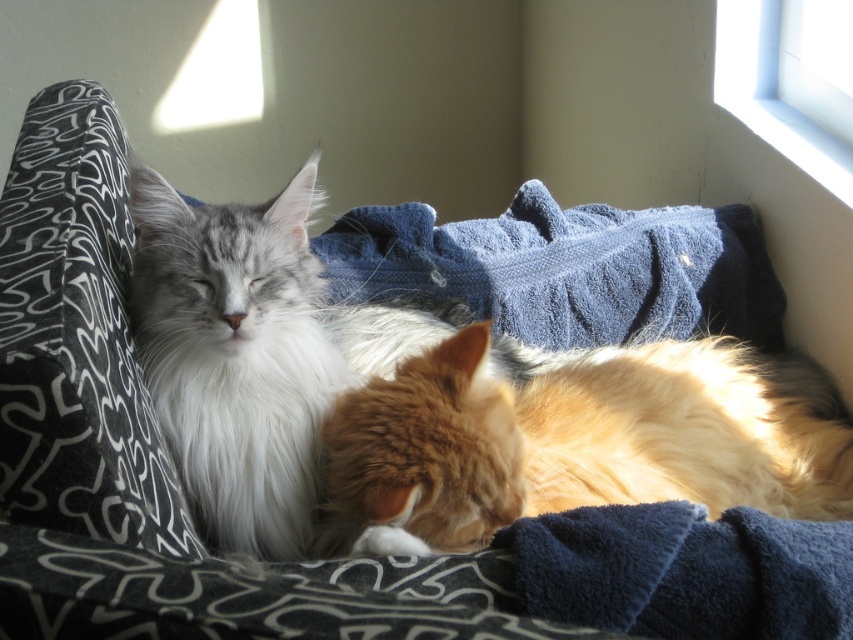
You are trying to determine the positions of two points in the image. The first point is at coordinate point (x=517, y=499) and the second is at point (x=302, y=348). Which point is nearer to you?

Point (x=517, y=499) is closer to the viewer than point (x=302, y=348).

Looking at this image, you are a photographer trying to capture a closeup of the golden fur cat at center. You are currently positioned at the point marked by coordinates point (x=579, y=440). Is this position suitable for taking the photo?

The point (x=579, y=440) marks the golden fur cat at center, so standing at this position would place you directly on the cat, making it impossible to take a photo from a suitable distance. Move slightly back to get a clear shot.